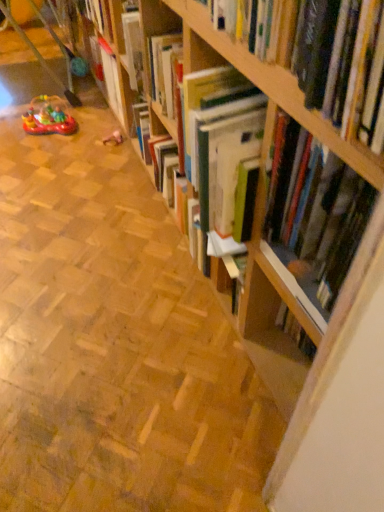
The height and width of the screenshot is (512, 384). I want to click on vacant area that lies between rubber boat at left, acting as the first toy starting from the left, and wooden bookcase at upper right, so click(109, 288).